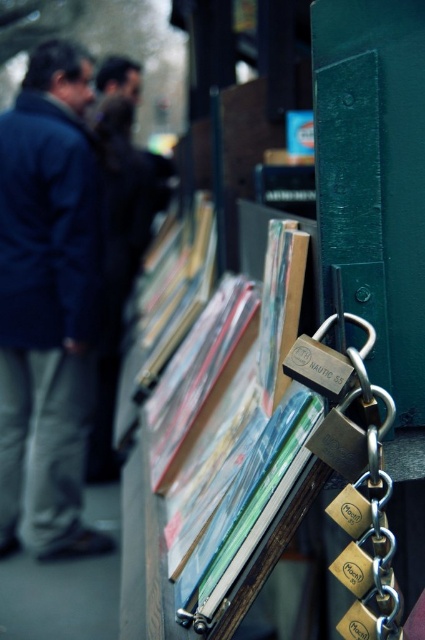
Question: Is dark blue jacket at left below matte plastic books at center?

Choices:
 (A) no
 (B) yes

Answer: (A)

Question: Does dark blue jacket at left come in front of matte plastic books at center?

Choices:
 (A) no
 (B) yes

Answer: (A)

Question: Does dark blue jacket at left have a greater width compared to matte plastic books at center?

Choices:
 (A) yes
 (B) no

Answer: (A)